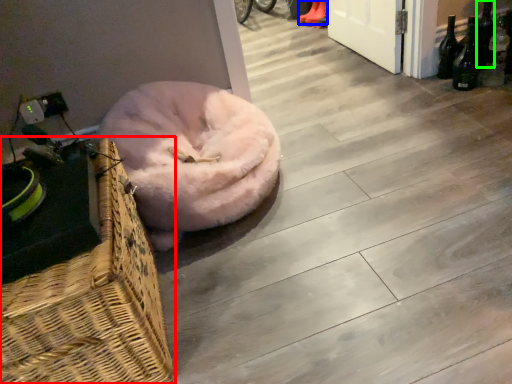
Question: Which object is the closest to the picnic basket (highlighted by a red box)? Choose among these: footwear (highlighted by a blue box) or bottle (highlighted by a green box).

Choices:
 (A) footwear
 (B) bottle

Answer: (B)